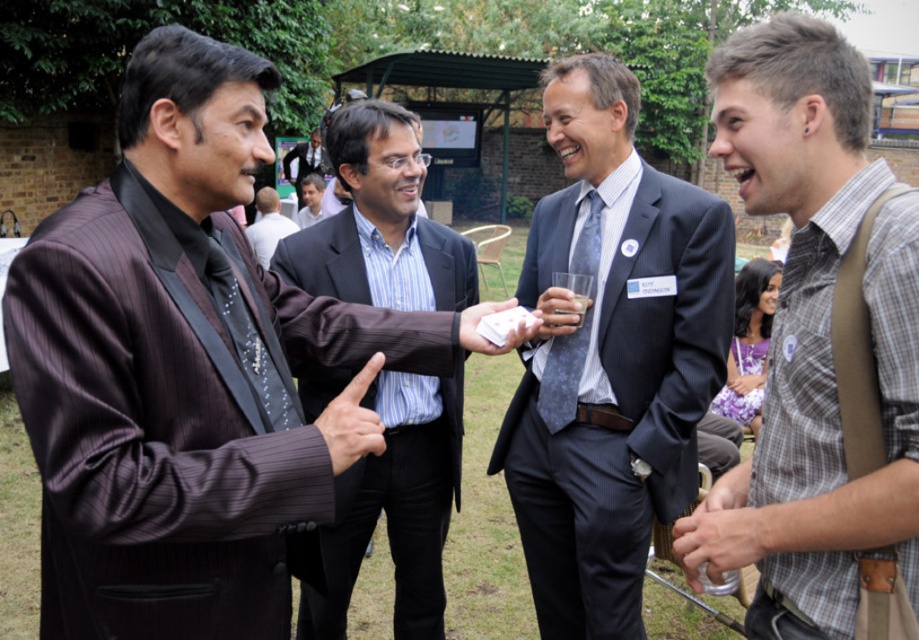
Question: Can you confirm if blue textured tie at center is thinner than striped suit at center?

Choices:
 (A) no
 (B) yes

Answer: (B)

Question: Can you confirm if dark blue suit at center is bigger than blue textured tie at center?

Choices:
 (A) no
 (B) yes

Answer: (B)

Question: Is dark blue suit at center positioned at the back of checkered shirt at center?

Choices:
 (A) no
 (B) yes

Answer: (B)

Question: Estimate the real-world distances between objects in this image. Which object is farther from the dark blue suit at center?

Choices:
 (A) translucent glass cup at center
 (B) shiny black suit at center
 (C) blue textured tie at center

Answer: (B)

Question: Considering the real-world distances, which object is closest to the translucent glass cup at center?

Choices:
 (A) checkered shirt at center
 (B) blue textured tie at center

Answer: (B)

Question: Which point is closer to the camera?

Choices:
 (A) (644, 456)
 (B) (755, 180)

Answer: (B)